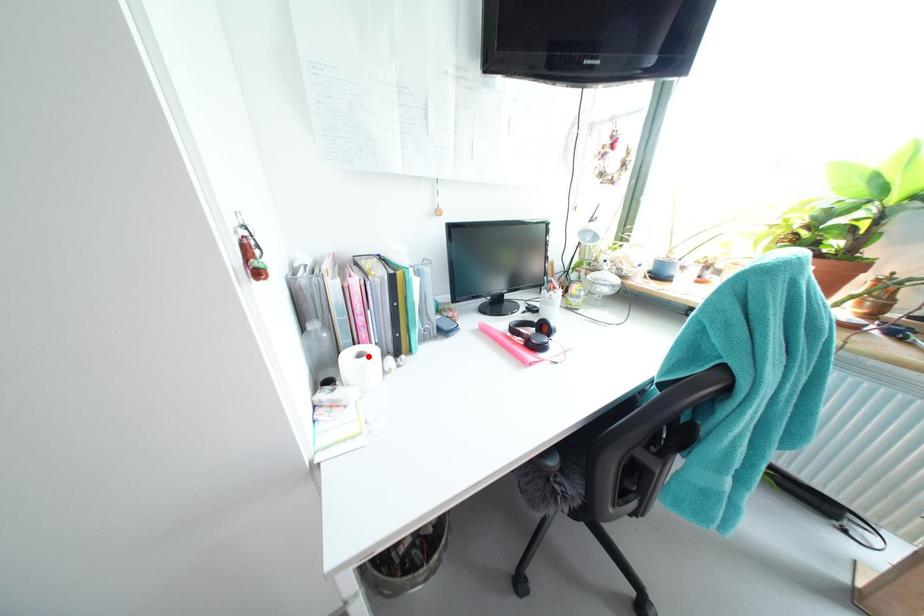
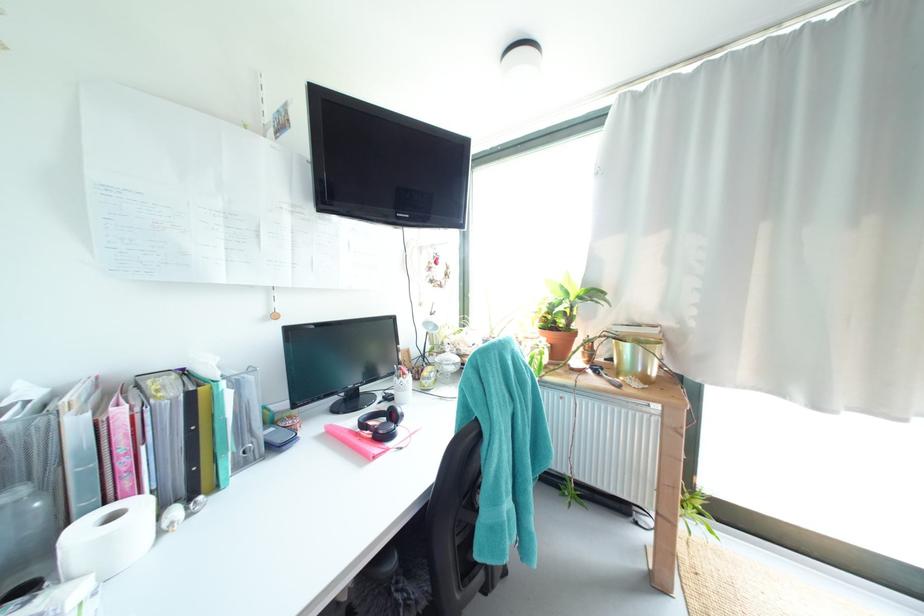
Find the pixel in the second image that matches the highlighted location in the first image.

(120, 517)